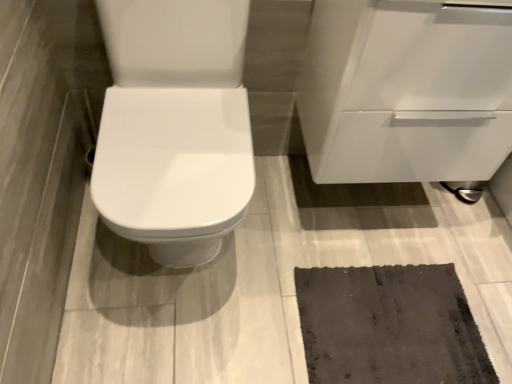
Question: Is white glossy cabinet at upper right far from dark gray textured mat at lower right?

Choices:
 (A) no
 (B) yes

Answer: (A)

Question: Is white glossy cabinet at upper right wider than dark gray textured mat at lower right?

Choices:
 (A) yes
 (B) no

Answer: (A)

Question: From a real-world perspective, is white glossy cabinet at upper right positioned over dark gray textured mat at lower right based on gravity?

Choices:
 (A) yes
 (B) no

Answer: (A)

Question: Is white glossy cabinet at upper right oriented towards dark gray textured mat at lower right?

Choices:
 (A) yes
 (B) no

Answer: (B)

Question: From the image's perspective, is white glossy cabinet at upper right on top of dark gray textured mat at lower right?

Choices:
 (A) no
 (B) yes

Answer: (B)

Question: Is white glossy cabinet at upper right in contact with dark gray textured mat at lower right?

Choices:
 (A) no
 (B) yes

Answer: (A)

Question: From the image's perspective, is dark gray textured mat at lower right beneath white glossy cabinet at upper right?

Choices:
 (A) no
 (B) yes

Answer: (B)

Question: Could you tell me if dark gray textured mat at lower right is facing white glossy cabinet at upper right?

Choices:
 (A) yes
 (B) no

Answer: (B)

Question: Is dark gray textured mat at lower right beside white glossy cabinet at upper right?

Choices:
 (A) no
 (B) yes

Answer: (A)

Question: Is dark gray textured mat at lower right to the right of white glossy cabinet at upper right from the viewer's perspective?

Choices:
 (A) yes
 (B) no

Answer: (B)

Question: From the image's perspective, would you say dark gray textured mat at lower right is positioned over white glossy cabinet at upper right?

Choices:
 (A) no
 (B) yes

Answer: (A)

Question: Is dark gray textured mat at lower right bigger than white glossy cabinet at upper right?

Choices:
 (A) yes
 (B) no

Answer: (B)

Question: From a real-world perspective, is dark gray textured mat at lower right physically located above or below white glossy cabinet at upper right?

Choices:
 (A) below
 (B) above

Answer: (A)